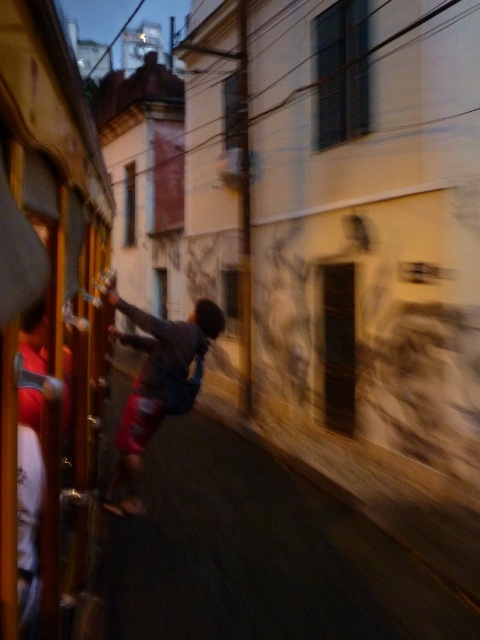
You are standing at the point marked by the coordinate point (47, 314) in the image. Based on the scene description, what object is located at this coordinate?

The metallic silver train car at left is located at point (47, 314).

You are a photographer trying to capture the best view of the European buildings outside. You have two windows available to shoot through in the train interior. Which window should you choose to get a wider shot of the buildings? The dark glass window at upper center or the smooth glass window at center?

The smooth glass window at center is wider than the dark glass window at upper center, so you should choose the smooth glass window at center to get a wider shot of the buildings.